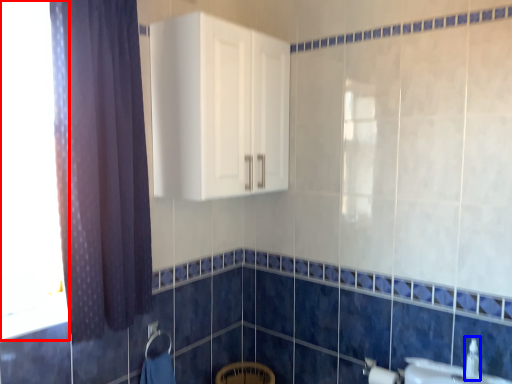
Question: Which point is further to the camera, window (highlighted by a red box) or plumbing fixture (highlighted by a blue box)?

Choices:
 (A) window
 (B) plumbing fixture

Answer: (B)